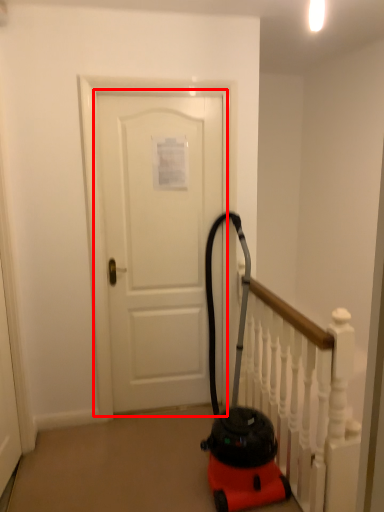
Question: From the image's perspective, where is door (annotated by the red box) located in relation to rail in the image?

Choices:
 (A) below
 (B) above

Answer: (B)